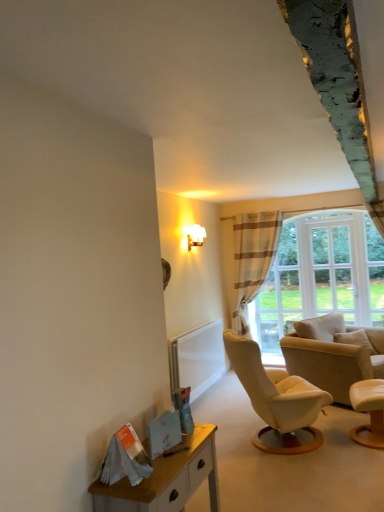
Question: In the image, is striped fabric curtain at center positioned in front of or behind white glass window at upper right?

Choices:
 (A) behind
 (B) front

Answer: (B)

Question: In terms of width, does striped fabric curtain at center look wider or thinner when compared to white glass window at upper right?

Choices:
 (A) wide
 (B) thin

Answer: (A)

Question: Based on their relative distances, which object is farther from the wooden desk at lower left?

Choices:
 (A) white glass window at upper right
 (B) smooth beige armchair at lower right, which is counted as the first chair, starting from the front
 (C) striped fabric curtain at center
 (D) white frosted glass wall sconce at upper center
 (E) beige leather chair at right, arranged as the 2th chair when viewed from the front

Answer: (C)

Question: Which object is positioned closest to the white textured radiator at lower center?

Choices:
 (A) wooden desk at lower left
 (B) striped fabric curtain at center
 (C) beige leather chair at right, arranged as the 2th chair when viewed from the front
 (D) white glass window at upper right
 (E) smooth beige armchair at lower right, which is counted as the first chair, starting from the front

Answer: (B)